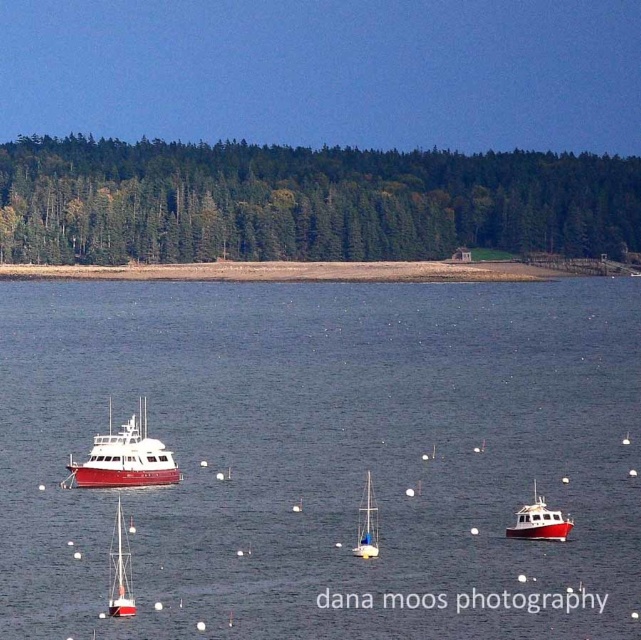
Question: Is smooth water at center further to the viewer compared to white matte boat at center-right?

Choices:
 (A) no
 (B) yes

Answer: (A)

Question: Estimate the real-world distances between objects in this image. Which object is farther from the white matte boat at center-right?

Choices:
 (A) white matte sailboat at lower left
 (B) white matte sailboat at center
 (C) smooth water at center
 (D) red matte boat at center

Answer: (C)

Question: Does red matte boat at center have a larger size compared to white matte sailboat at lower left?

Choices:
 (A) no
 (B) yes

Answer: (B)

Question: Is smooth water at center closer to camera compared to white matte boat at center-right?

Choices:
 (A) yes
 (B) no

Answer: (A)

Question: Which object appears farthest from the camera in this image?

Choices:
 (A) white matte sailboat at center
 (B) white matte sailboat at lower left
 (C) smooth water at center

Answer: (A)

Question: Which object is positioned closest to the white matte sailboat at lower left?

Choices:
 (A) red matte boat at center
 (B) white matte sailboat at center
 (C) white matte boat at center-right

Answer: (B)